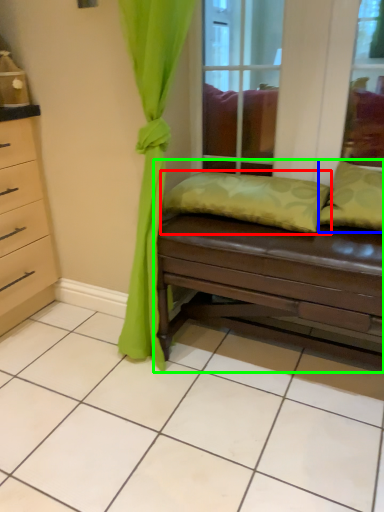
Question: Considering the real-world distances, which object is closest to pillow (highlighted by a red box)? pillow (highlighted by a blue box) or studio couch (highlighted by a green box).

Choices:
 (A) pillow
 (B) studio couch

Answer: (B)